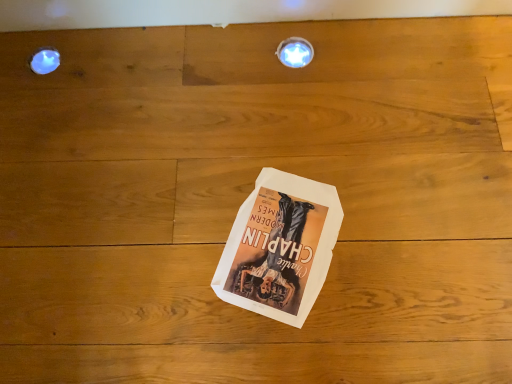
You are a GUI agent. You are given a task and a screenshot of the screen. Output one action in this format:
    pyautogui.click(x=<x>, y=<y>)
    Task: Click on the free space to the left of white paper at center
    
    Given the screenshot: What is the action you would take?
    pyautogui.click(x=166, y=248)